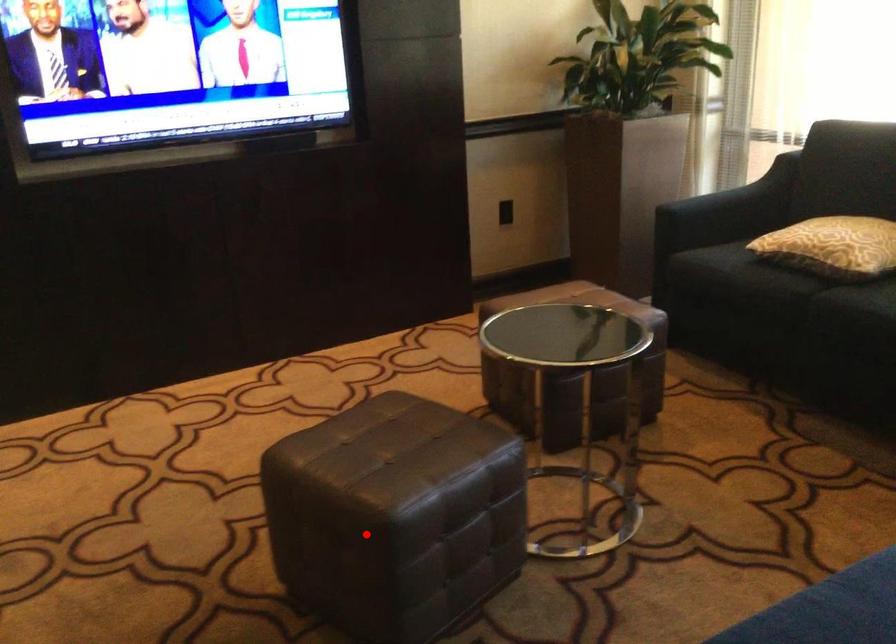
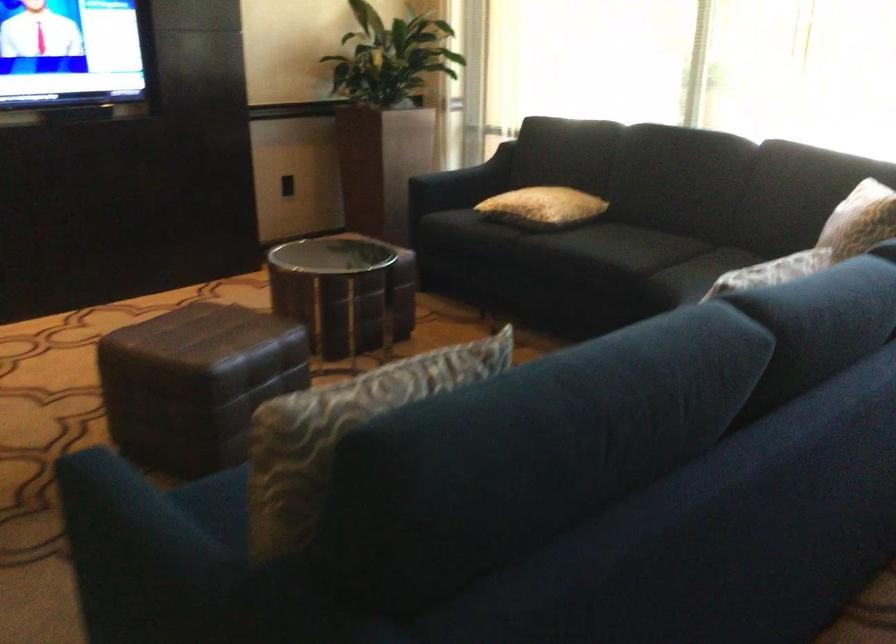
In the second image, find the point that corresponds to the highlighted location in the first image.

(195, 383)